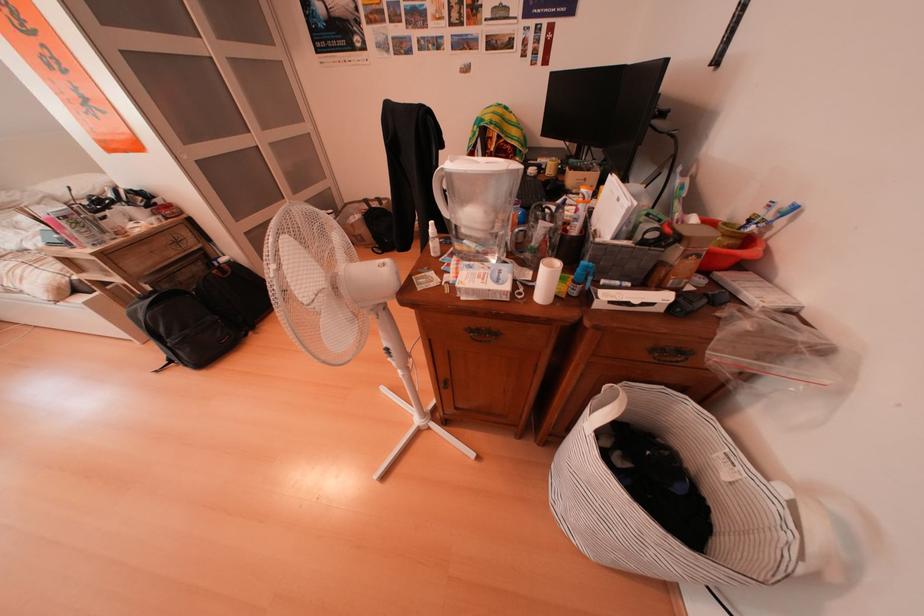
The height and width of the screenshot is (616, 924). Describe the element at coordinates (477, 204) in the screenshot. I see `the glass mug handle` at that location.